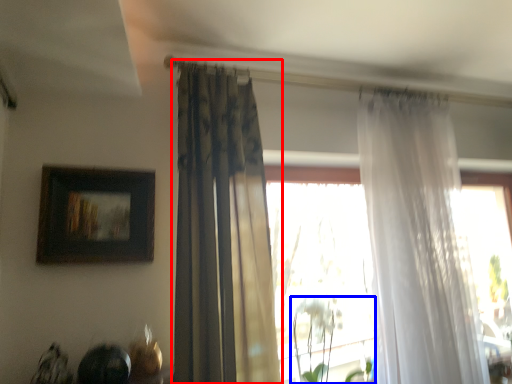
Question: Which object appears farthest to the camera in this image, curtain (highlighted by a red box) or plant (highlighted by a blue box)?

Choices:
 (A) curtain
 (B) plant

Answer: (B)